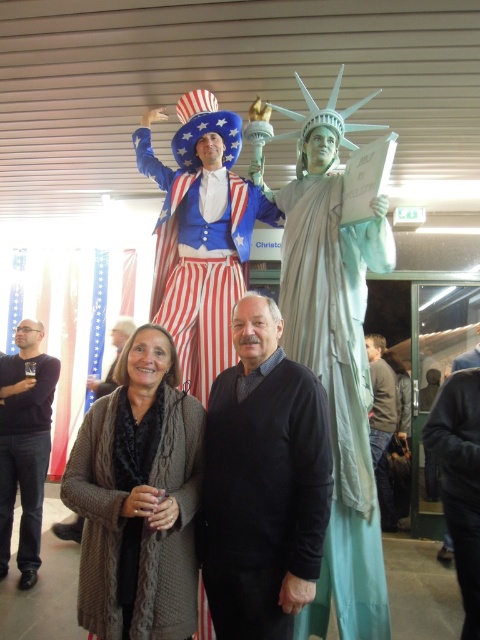
Question: Which is nearer to the matte blue and white striped pants at center?

Choices:
 (A) knitted gray cardigan at center
 (B) light blue fabric statue at center
 (C) dark gray sweater at right

Answer: (B)

Question: Is black velvet sweater at center further to the viewer compared to knitted gray cardigan at center?

Choices:
 (A) yes
 (B) no

Answer: (A)

Question: In this image, where is matte blue and white striped pants at center located relative to smooth gray sweater at center?

Choices:
 (A) left
 (B) right

Answer: (B)

Question: Which object is closer to the camera taking this photo?

Choices:
 (A) light blue fabric statue at center
 (B) smooth gray sweater at center
 (C) matte blue and white striped pants at center
 (D) black velvet sweater at center

Answer: (D)

Question: Is knitted gray cardigan at center above smooth gray sweater at center?

Choices:
 (A) yes
 (B) no

Answer: (B)

Question: Based on their relative distances, which object is nearer to the black velvet sweater at center?

Choices:
 (A) knitted sweater at center
 (B) matte blue and white striped pants at center

Answer: (A)